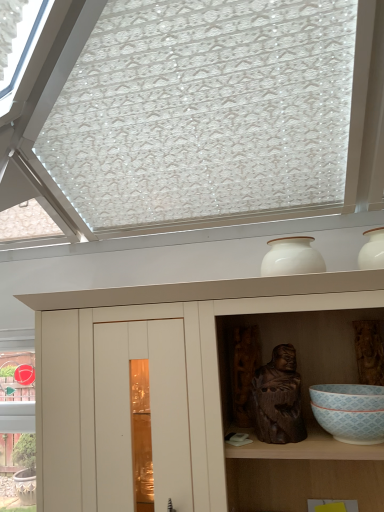
Describe the element at coordinates (292, 257) in the screenshot. I see `white glossy vase at upper center` at that location.

At what (x,y) coordinates should I click in order to perform the action: click on dark brown wood statue at center. Please return your answer as a coordinate pair (x, y). This screenshot has width=384, height=512. Looking at the image, I should click on pyautogui.click(x=278, y=399).

Describe the element at coordinates (350, 411) in the screenshot. I see `white glossy bowl at lower right` at that location.

Where is `white matte cupboard at upper center`? This screenshot has height=512, width=384. white matte cupboard at upper center is located at coordinates (186, 367).

This screenshot has height=512, width=384. Find the location of `white glossy vase at upper center`. white glossy vase at upper center is located at coordinates (292, 257).

Which object is thinner, dark brown wood statue at center or white glossy bowl at lower right?

dark brown wood statue at center is thinner.

Does dark brown wood statue at center appear on the left side of white glossy bowl at lower right?

Yes.

Is point (264, 387) closer or farther from the camera than point (379, 398)?

Point (264, 387) appears to be farther away from the viewer than point (379, 398).

Is white glossy vase at upper center with dark brown wood statue at center?

white glossy vase at upper center and dark brown wood statue at center are clearly separated.

From the picture: From the image's perspective, is white glossy vase at upper center on dark brown wood statue at center?

Yes, from the image's perspective, white glossy vase at upper center is on top of dark brown wood statue at center.

Considering the points (305, 239) and (262, 371), which point is behind, point (305, 239) or point (262, 371)?

The point (262, 371) is farther.

From a real-world perspective, is dark brown wood statue at center physically below white matte cupboard at upper center?

No, from a real-world perspective, dark brown wood statue at center is not beneath white matte cupboard at upper center.

Consider the image. How distant is dark brown wood statue at center from white matte cupboard at upper center?

dark brown wood statue at center is 10.09 inches from white matte cupboard at upper center.

Is dark brown wood statue at center placed right next to white matte cupboard at upper center?

dark brown wood statue at center and white matte cupboard at upper center are clearly separated.

Which of these two, dark brown wood statue at center or white matte cupboard at upper center, is thinner?

With smaller width is dark brown wood statue at center.

Where is `sculpture above the white glossy bowl at lower right (from the image's perspective)`? sculpture above the white glossy bowl at lower right (from the image's perspective) is located at coordinates (278, 399).

Is white glossy bowl at lower right located outside dark brown wood statue at center?

white glossy bowl at lower right lies outside dark brown wood statue at center's area.

Who is bigger, white glossy bowl at lower right or dark brown wood statue at center?

With larger size is dark brown wood statue at center.

Who is bigger, white matte cupboard at upper center or dark brown wood statue at center?

white matte cupboard at upper center.

Does white matte cupboard at upper center turn towards dark brown wood statue at center?

Yes, white matte cupboard at upper center faces towards dark brown wood statue at center.

Which is behind, point (206, 506) or point (264, 401)?

The point (264, 401) is farther.

Considering the positions of objects white matte cupboard at upper center and dark brown wood statue at center in the image provided, who is more to the left, white matte cupboard at upper center or dark brown wood statue at center?

white matte cupboard at upper center is more to the left.

Is white glossy bowl at lower right far away from white glossy vase at upper center?

white glossy bowl at lower right is actually quite close to white glossy vase at upper center.

From the image's perspective, which is above, white glossy bowl at lower right or white glossy vase at upper center?

From the image's view, white glossy vase at upper center is above.

From a real-world perspective, who is located higher, white glossy bowl at lower right or white glossy vase at upper center?

white glossy vase at upper center, from a real-world perspective.

Based on the photo, considering the positions of objects white glossy bowl at lower right and white glossy vase at upper center in the image provided, who is behind, white glossy bowl at lower right or white glossy vase at upper center?

Positioned behind is white glossy vase at upper center.

Is white matte cupboard at upper center with white glossy bowl at lower right?

white matte cupboard at upper center is not next to white glossy bowl at lower right, and they're not touching.

Considering the relative sizes of white matte cupboard at upper center and white glossy bowl at lower right in the image provided, is white matte cupboard at upper center shorter than white glossy bowl at lower right?

No, white matte cupboard at upper center is not shorter than white glossy bowl at lower right.

You are a GUI agent. You are given a task and a screenshot of the screen. Output one action in this format:
    pyautogui.click(x=<x>, y=<y>)
    Task: Click on the sculpture above the white glossy bowl at lower right (from a real-world perspective)
    This screenshot has width=384, height=512.
    Given the screenshot: What is the action you would take?
    pyautogui.click(x=278, y=399)

Where is `vase above the dark brown wood statue at center (from the image's perspective)`? The height and width of the screenshot is (512, 384). vase above the dark brown wood statue at center (from the image's perspective) is located at coordinates (292, 257).

Which object lies nearer to the anchor point white glossy vase at upper center, white matte cupboard at upper center or dark brown wood statue at center?

dark brown wood statue at center.

Based on their spatial positions, is white matte cupboard at upper center or white glossy bowl at lower right further from dark brown wood statue at center?

Based on the image, white matte cupboard at upper center appears to be further to dark brown wood statue at center.

Based on the photo, based on their spatial positions, is white matte cupboard at upper center or dark brown wood statue at center further from white glossy bowl at lower right?

Based on the image, white matte cupboard at upper center appears to be further to white glossy bowl at lower right.

Based on their spatial positions, is white glossy vase at upper center or white matte cupboard at upper center closer to white glossy bowl at lower right?

The object closer to white glossy bowl at lower right is white glossy vase at upper center.

From the image, which object appears to be farther from dark brown wood statue at center, white glossy vase at upper center or white glossy bowl at lower right?

white glossy vase at upper center.

Which object lies nearer to the anchor point white glossy vase at upper center, dark brown wood statue at center or white matte cupboard at upper center?

dark brown wood statue at center lies closer to white glossy vase at upper center than the other object.

When comparing their distances from white glossy vase at upper center, does white matte cupboard at upper center or white glossy bowl at lower right seem further?

white glossy bowl at lower right.

Which object lies further to the anchor point white matte cupboard at upper center, dark brown wood statue at center or white glossy vase at upper center?

The object further to white matte cupboard at upper center is white glossy vase at upper center.

The height and width of the screenshot is (512, 384). I want to click on sculpture between white matte cupboard at upper center and white glossy bowl at lower right in the horizontal direction, so click(278, 399).

Find the location of `sculpture between white glossy vase at upper center and white glossy bowl at lower right in the up-down direction`. sculpture between white glossy vase at upper center and white glossy bowl at lower right in the up-down direction is located at coordinates (278, 399).

Identify the location of sculpture between white glossy vase at upper center and white matte cupboard at upper center vertically. The width and height of the screenshot is (384, 512). (278, 399).

In order to click on bowl between white glossy vase at upper center and white matte cupboard at upper center in the up-down direction in this screenshot , I will do `click(350, 411)`.